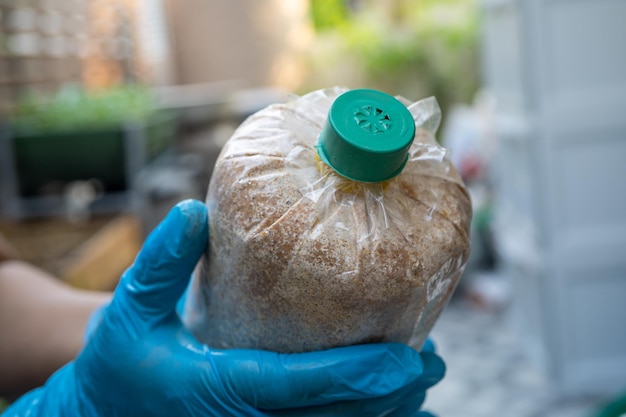
In order to click on storage organizer in this screenshot , I will do tap(567, 196).